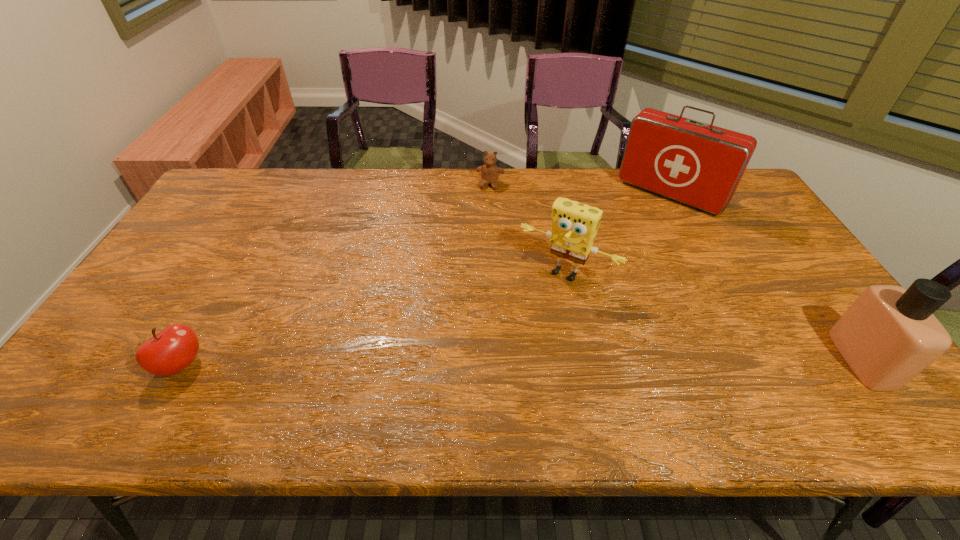
You are a GUI agent. You are given a task and a screenshot of the screen. Output one action in this format:
    pyautogui.click(x=<x>, y=<y>)
    Task: Click on the vacant space that is in between the perfume and the third farthest object
    Image resolution: width=960 pixels, height=540 pixels.
    Given the screenshot: What is the action you would take?
    pyautogui.click(x=714, y=315)

Find the location of a particular element. This screenshot has width=960, height=540. vacant region between the third object from right to left and the leftmost object is located at coordinates (373, 318).

Identify the location of empty location between the apple and the fourth object from left to right. (425, 279).

Identify the location of vacant region between the leftmost object and the teddy bear. The height and width of the screenshot is (540, 960). (336, 274).

The height and width of the screenshot is (540, 960). Find the location of `empty space that is in between the third farthest object and the first-aid kit`. empty space that is in between the third farthest object and the first-aid kit is located at coordinates (618, 233).

At what (x,y) coordinates should I click in order to perform the action: click on free spot between the third nearest object and the first-aid kit. Please return your answer as a coordinate pair (x, y). Looking at the image, I should click on (618, 233).

You are a GUI agent. You are given a task and a screenshot of the screen. Output one action in this format:
    pyautogui.click(x=<x>, y=<y>)
    Task: Click on the free space between the sponge and the tallest object
    This screenshot has height=540, width=960.
    Given the screenshot: What is the action you would take?
    tap(618, 233)

I want to click on object identified as the second closest to the second object from right to left, so click(490, 172).

Where is `object that can be found as the closest to the leftmost object`? This screenshot has width=960, height=540. object that can be found as the closest to the leftmost object is located at coordinates (574, 225).